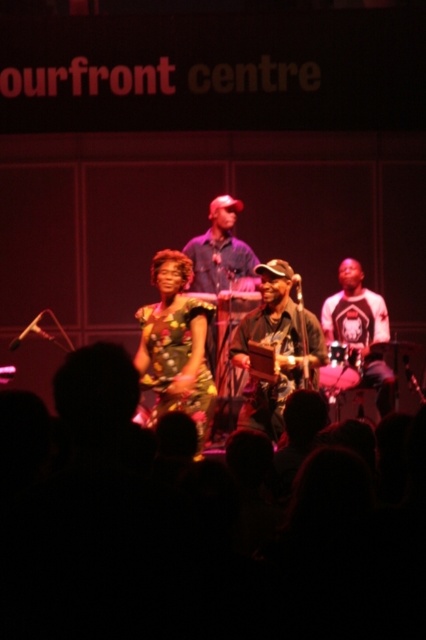
Does printed fabric dress at center appear under matte black guitar at center?

Yes, printed fabric dress at center is below matte black guitar at center.

Does printed fabric dress at center have a greater height compared to matte black guitar at center?

Yes, printed fabric dress at center is taller than matte black guitar at center.

Who is more forward, (181, 282) or (242, 355)?

Positioned in front is point (181, 282).

Where is `printed fabric dress at center`? printed fabric dress at center is located at coordinates (175, 342).